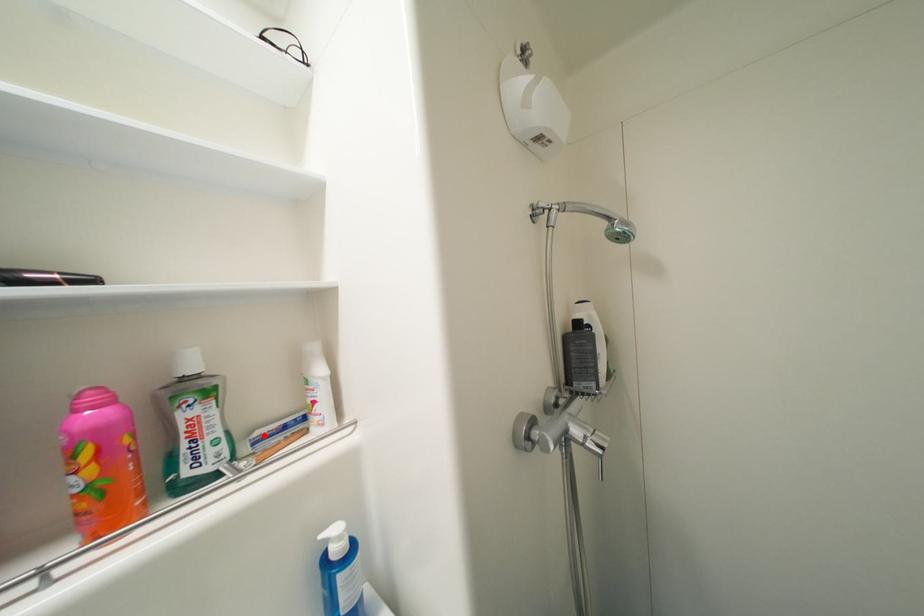
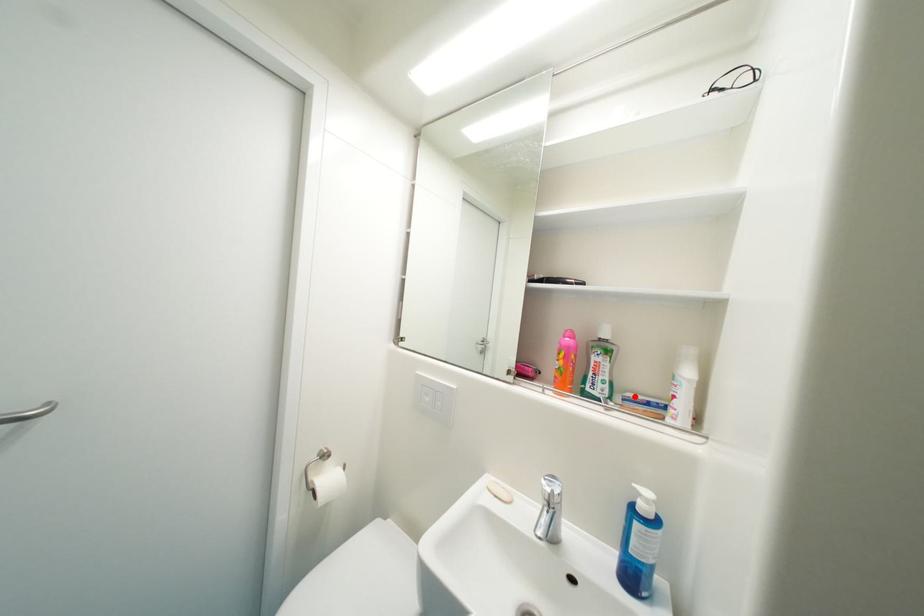
I am providing you with two images of the same scene from different viewpoints. A red point is marked on the first image and another point is marked on the second image. Are the points marked in image1 and image2 representing the same 3D position?

Yes